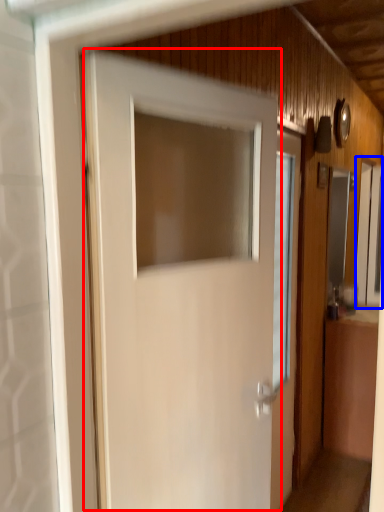
Question: Which object appears farthest to the camera in this image, door (highlighted by a red box) or window (highlighted by a blue box)?

Choices:
 (A) door
 (B) window

Answer: (B)